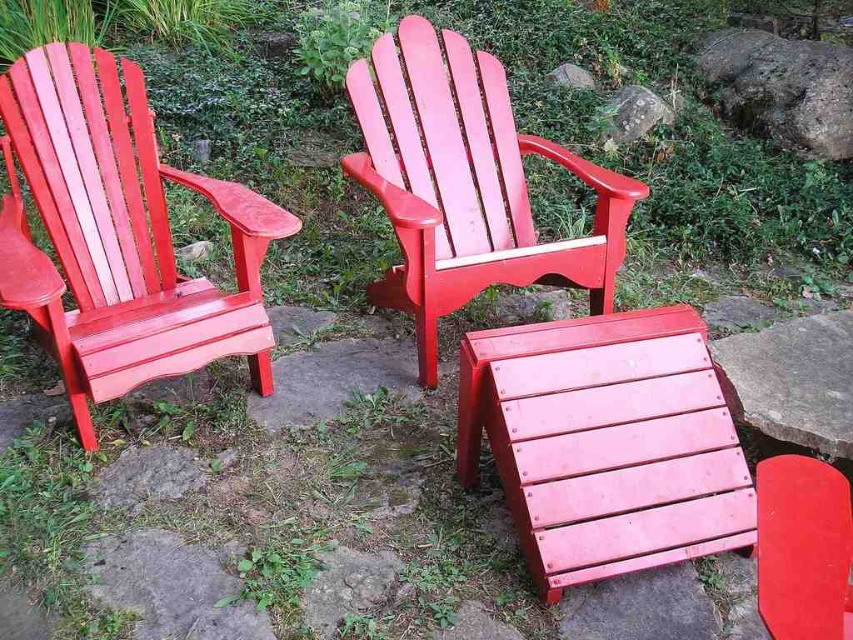
Question: Which of the following is the farthest from the observer?

Choices:
 (A) matte wood chair at left
 (B) smooth gray rock at upper center
 (C) gray rough rock at upper right
 (D) smooth gray stone at center

Answer: (B)

Question: Can you confirm if matte wood chair at center is wider than smooth gray stone at center?

Choices:
 (A) yes
 (B) no

Answer: (A)

Question: Estimate the real-world distances between objects in this image. Which object is farther from the gray stone at center?

Choices:
 (A) matte wood chair at center
 (B) gray rough rock at upper right
 (C) matte wood chair at left
 (D) smooth gray stone at center

Answer: (C)

Question: Is gray rough rock at upper right below gray stone at center?

Choices:
 (A) yes
 (B) no

Answer: (A)

Question: Does smooth gray rock at upper center appear on the right side of gray stone at center?

Choices:
 (A) no
 (B) yes

Answer: (B)

Question: Which of these objects is positioned closest to the smooth gray stone at center?

Choices:
 (A) gray rough rock at upper right
 (B) matte wood chair at center
 (C) gray stone at center
 (D) matte wood chair at left

Answer: (B)